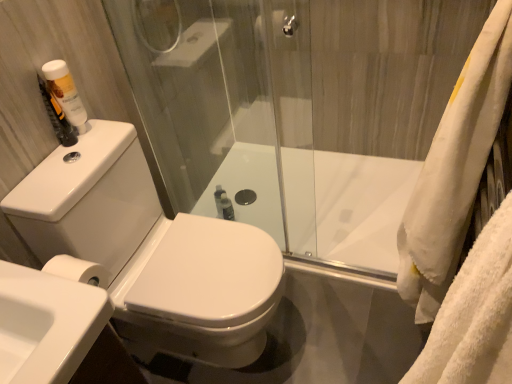
You are a GUI agent. You are given a task and a screenshot of the screen. Output one action in this format:
    pyautogui.click(x=<x>, y=<y>)
    Task: Click on the empty space that is to the right of transparent glass shower door at upper right
    
    Given the screenshot: What is the action you would take?
    pyautogui.click(x=377, y=255)